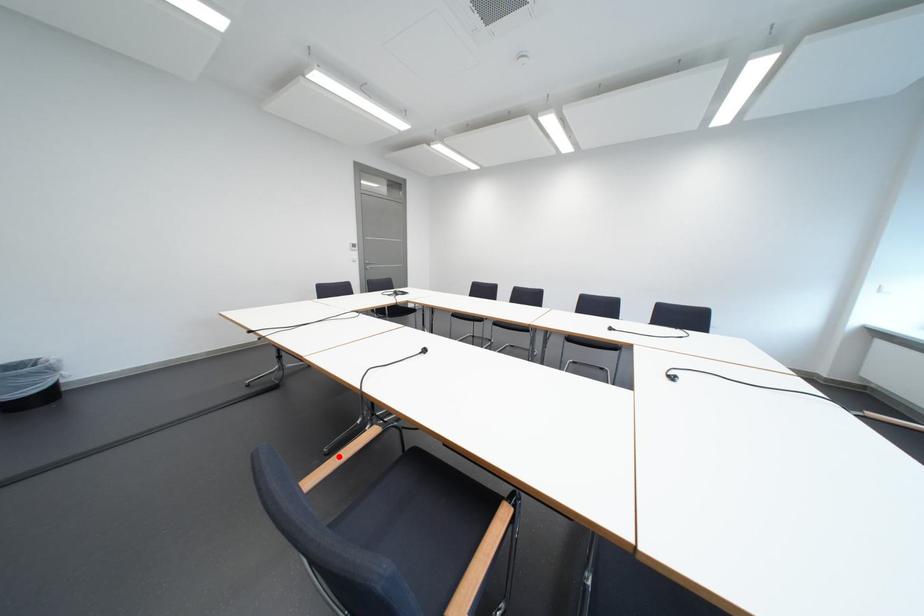
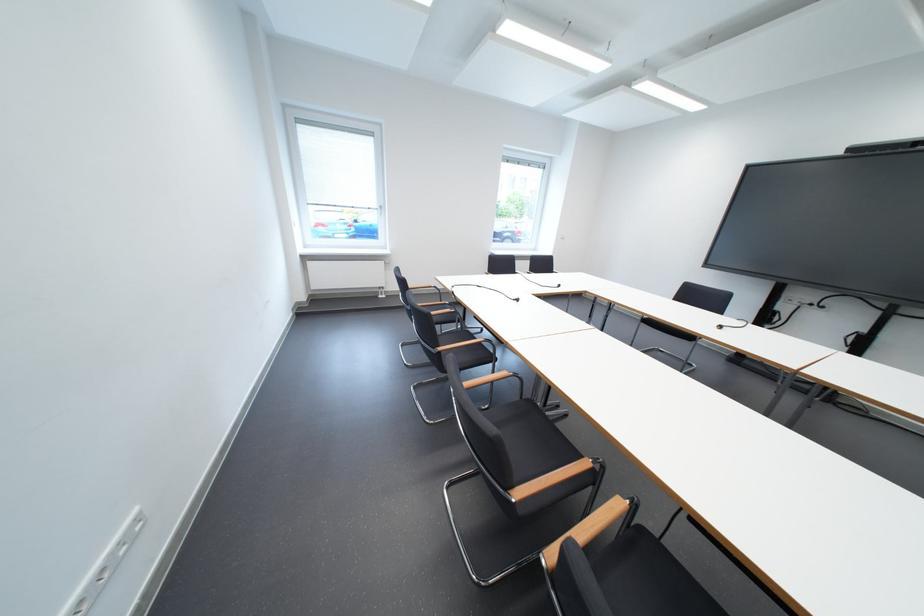
Question: I am providing you with two images of the same scene from different viewpoints. A red point is marked on the first image. Can you still see the location of the red point in image 2?

Choices:
 (A) Yes
 (B) No

Answer: (B)